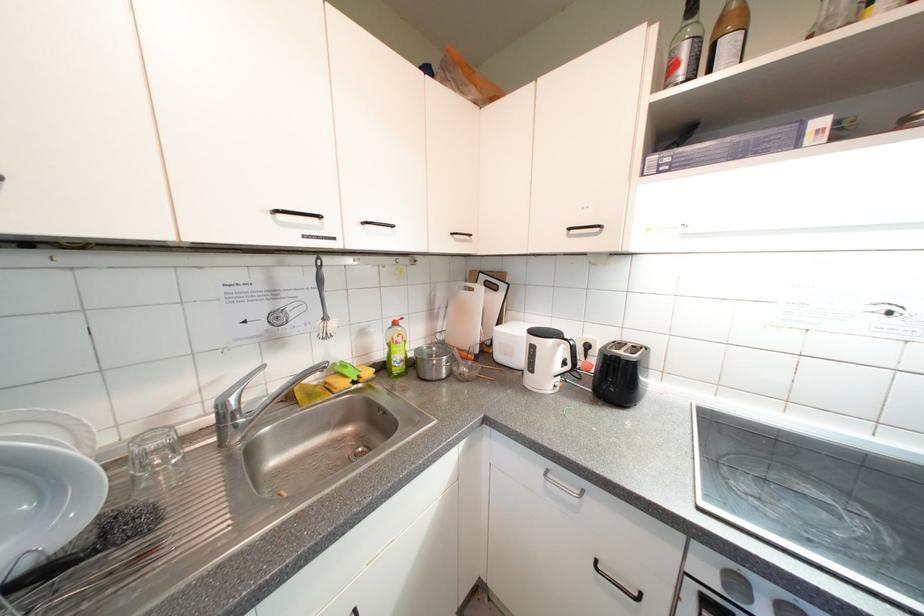
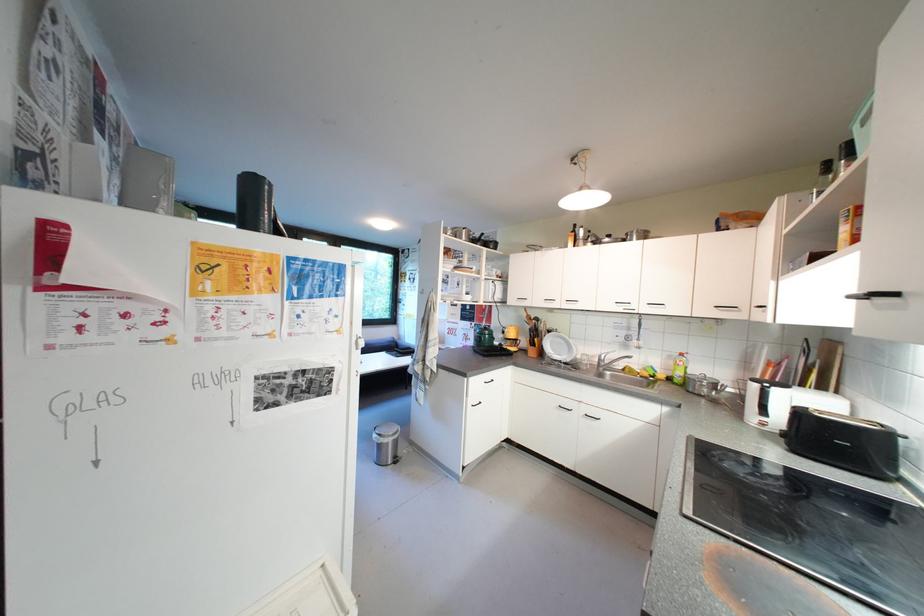
In the second image, find the point that corresponds to point (373, 225) in the first image.

(657, 306)